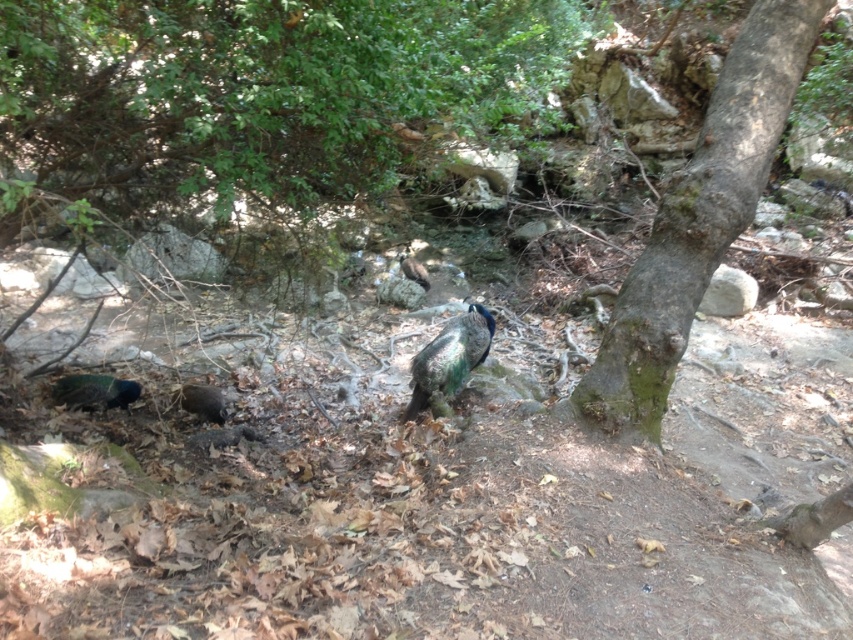
You are a wildlife photographer aiming to capture both the shiny green peacock at center and the green iridescent peacock at center in a single frame. Given that your camera has a maximum focus range of 4 meters, will you be able to focus on both peacocks simultaneously?

The shiny green peacock at center is 3.76 meters away from the green iridescent peacock at center. Since the distance between them is within the camera maximum focus range of 4 meters, you can focus on both peacocks simultaneously.

You are standing at the center of the image and want to locate the shiny black peacock at lower left. According to the coordinates provided, in which direction should you look to find it?

The shiny black peacock at lower left is located at coordinates point [202,401], which is to the lower left direction from the center of the image.